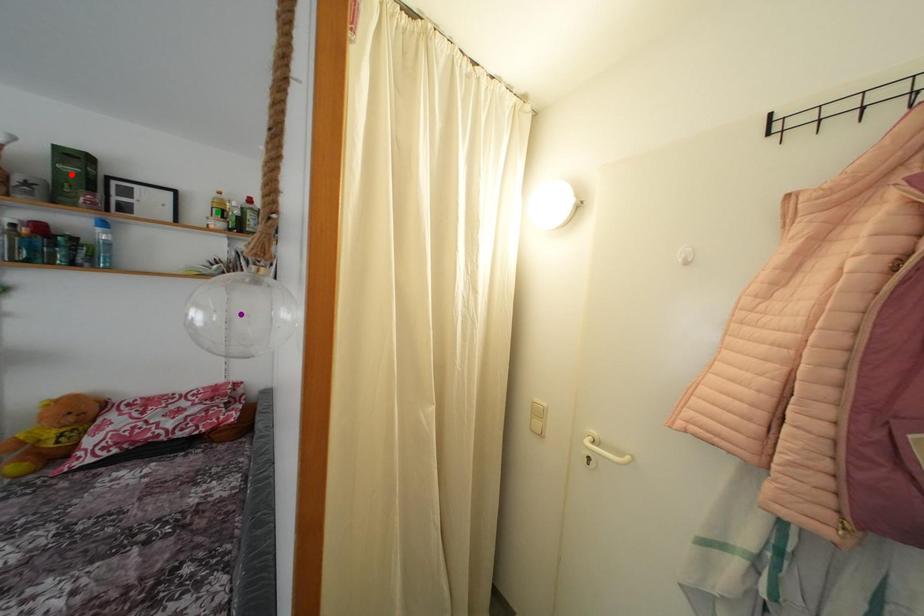
Order these from farthest to nearest:
red point, green point, purple point

green point → red point → purple point